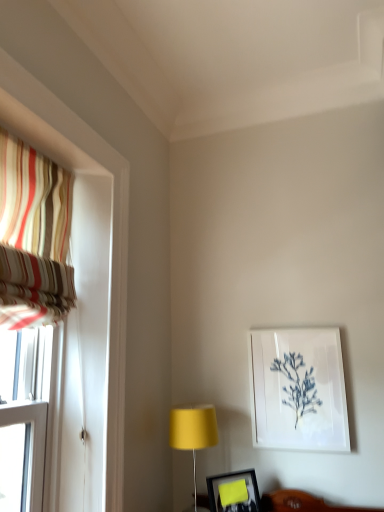
What do you see at coordinates (193, 430) in the screenshot? The height and width of the screenshot is (512, 384). I see `matte yellow lampshade at center` at bounding box center [193, 430].

Image resolution: width=384 pixels, height=512 pixels. What do you see at coordinates (234, 492) in the screenshot?
I see `matte black picture frame at lower center, the 1th picture frame from the left` at bounding box center [234, 492].

I want to click on matte yellow lampshade at center, so click(193, 430).

This screenshot has height=512, width=384. What are the coordinates of `table lamp in front of the matte black picture frame at lower center, which appears as the 2th picture frame when viewed from the right` in the screenshot? It's located at [x=193, y=430].

In the scene shown: From the image's perspective, does matte yellow lampshade at center appear higher than matte black picture frame at lower center, the 1th picture frame from the left?

Yes, from the image's perspective, matte yellow lampshade at center is above matte black picture frame at lower center, the 1th picture frame from the left.

Could you tell me if matte yellow lampshade at center is turned towards matte black picture frame at lower center, which appears as the 2th picture frame when viewed from the right?

No, matte yellow lampshade at center is not turned towards matte black picture frame at lower center, which appears as the 2th picture frame when viewed from the right.

Can you tell me how much matte black picture frame at lower center, the first picture frame positioned from the front, and striped fabric curtain at left differ in facing direction?

The facing directions of matte black picture frame at lower center, the first picture frame positioned from the front, and striped fabric curtain at left are 46.6 degrees apart.

Is matte black picture frame at lower center, which is the 2th picture frame in back-to-front order, positioned beyond the bounds of striped fabric curtain at left?

Yes, matte black picture frame at lower center, which is the 2th picture frame in back-to-front order, is not within striped fabric curtain at left.

Could you tell me if matte black picture frame at lower center, which is the 2th picture frame in top-to-bottom order, is turned towards striped fabric curtain at left?

No, matte black picture frame at lower center, which is the 2th picture frame in top-to-bottom order, does not turn towards striped fabric curtain at left.

Based on the photo, from the image's perspective, between matte black picture frame at lower center, the 1th picture frame from the bottom, and striped fabric curtain at left, who is located below?

matte black picture frame at lower center, the 1th picture frame from the bottom, from the image's perspective.

In the scene shown: From a real-world perspective, is matte yellow lampshade at center over striped fabric curtain at left?

No, from a real-world perspective, matte yellow lampshade at center is not over striped fabric curtain at left

Based on the photo, would you consider matte yellow lampshade at center to be distant from striped fabric curtain at left?

matte yellow lampshade at center is actually quite close to striped fabric curtain at left.

Which point is more forward, (x=211, y=436) or (x=44, y=275)?

The point (x=44, y=275) is more forward.

Considering the sizes of objects matte yellow lampshade at center and white paper at upper right, which is counted as the second picture frame, starting from the front, in the image provided, who is wider, matte yellow lampshade at center or white paper at upper right, which is counted as the second picture frame, starting from the front,?

matte yellow lampshade at center.

Are matte yellow lampshade at center and white paper at upper right, which ranks as the second picture frame in left-to-right order, making contact?

No, matte yellow lampshade at center is not making contact with white paper at upper right, which ranks as the second picture frame in left-to-right order.

From a real-world perspective, between matte yellow lampshade at center and white paper at upper right, which ranks as the second picture frame in left-to-right order, who is vertically lower?

matte yellow lampshade at center, from a real-world perspective.

Could you tell me if matte yellow lampshade at center is facing white paper at upper right, acting as the 1th picture frame starting from the right?

No, matte yellow lampshade at center is not oriented towards white paper at upper right, acting as the 1th picture frame starting from the right.

How many degrees apart are the facing directions of matte black picture frame at lower center, the 1th picture frame from the bottom, and white paper at upper right, the first picture frame from the back?

They differ by 44 degrees in their facing directions.

From their relative heights in the image, would you say matte black picture frame at lower center, the 1th picture frame from the left, is taller or shorter than white paper at upper right, which is counted as the second picture frame, starting from the front?

Clearly, matte black picture frame at lower center, the 1th picture frame from the left, is shorter compared to white paper at upper right, which is counted as the second picture frame, starting from the front.

Is matte black picture frame at lower center, which is the 2th picture frame in top-to-bottom order, bigger or smaller than white paper at upper right, placed as the 1th picture frame when sorted from top to bottom?

Considering their sizes, matte black picture frame at lower center, which is the 2th picture frame in top-to-bottom order, takes up less space than white paper at upper right, placed as the 1th picture frame when sorted from top to bottom.

Relative to white paper at upper right, placed as the 1th picture frame when sorted from top to bottom, is matte black picture frame at lower center, the 1th picture frame from the left, in front or behind?

Clearly, matte black picture frame at lower center, the 1th picture frame from the left, is in front of white paper at upper right, placed as the 1th picture frame when sorted from top to bottom.

Considering the relative sizes of white paper at upper right, acting as the 1th picture frame starting from the right, and matte yellow lampshade at center in the image provided, is white paper at upper right, acting as the 1th picture frame starting from the right, wider than matte yellow lampshade at center?

No, white paper at upper right, acting as the 1th picture frame starting from the right, is not wider than matte yellow lampshade at center.

From the image's perspective, which is above, white paper at upper right, which ranks as the second picture frame in left-to-right order, or matte yellow lampshade at center?

white paper at upper right, which ranks as the second picture frame in left-to-right order, is shown above in the image.

How different are the orientations of white paper at upper right, the first picture frame from the back, and matte yellow lampshade at center in degrees?

0.77 degrees.

Considering the positions of objects white paper at upper right, placed as the 1th picture frame when sorted from top to bottom, and matte yellow lampshade at center in the image provided, who is more to the left, white paper at upper right, placed as the 1th picture frame when sorted from top to bottom, or matte yellow lampshade at center?

matte yellow lampshade at center is more to the left.

Considering the relative sizes of white paper at upper right, the first picture frame from the back, and striped fabric curtain at left in the image provided, is white paper at upper right, the first picture frame from the back, thinner than striped fabric curtain at left?

Result: Yes, white paper at upper right, the first picture frame from the back, is thinner than striped fabric curtain at left.

Can you confirm if white paper at upper right, which ranks as the second picture frame in left-to-right order, is positioned to the left of striped fabric curtain at left?

In fact, white paper at upper right, which ranks as the second picture frame in left-to-right order, is to the right of striped fabric curtain at left.

From a real-world perspective, relative to striped fabric curtain at left, is white paper at upper right, which is counted as the second picture frame, starting from the front, vertically above or below?

Clearly, from a real-world perspective, white paper at upper right, which is counted as the second picture frame, starting from the front, is below striped fabric curtain at left.

Identify the location of the 1st picture frame behind the matte yellow lampshade at center. Image resolution: width=384 pixels, height=512 pixels. (234, 492).

Where is `curtain that is above the matte black picture frame at lower center, the 1th picture frame from the left (from a real-world perspective)`? This screenshot has height=512, width=384. curtain that is above the matte black picture frame at lower center, the 1th picture frame from the left (from a real-world perspective) is located at coordinates (33, 237).

From the picture: Considering their positions, is white paper at upper right, which ranks as the second picture frame in left-to-right order, positioned closer to striped fabric curtain at left than matte yellow lampshade at center?

matte yellow lampshade at center is closer to striped fabric curtain at left.

Based on their spatial positions, is matte black picture frame at lower center, the first picture frame positioned from the front, or striped fabric curtain at left further from white paper at upper right, the first picture frame from the back?

striped fabric curtain at left is positioned further to the anchor white paper at upper right, the first picture frame from the back.

From the picture: When comparing their distances from matte black picture frame at lower center, the first picture frame positioned from the front, does white paper at upper right, the second picture frame in the bottom-to-top sequence, or matte yellow lampshade at center seem closer?

matte yellow lampshade at center.

From the image, which object appears to be nearer to matte black picture frame at lower center, the 1th picture frame from the left, striped fabric curtain at left or matte yellow lampshade at center?

matte yellow lampshade at center.

Based on their spatial positions, is white paper at upper right, placed as the 1th picture frame when sorted from top to bottom, or matte black picture frame at lower center, the 1th picture frame from the bottom, closer to striped fabric curtain at left?

Among the two, white paper at upper right, placed as the 1th picture frame when sorted from top to bottom, is located nearer to striped fabric curtain at left.

Considering their positions, is matte black picture frame at lower center, which is the 2th picture frame in top-to-bottom order, positioned closer to striped fabric curtain at left than matte yellow lampshade at center?

The object closer to striped fabric curtain at left is matte yellow lampshade at center.

Based on their spatial positions, is striped fabric curtain at left or white paper at upper right, placed as the 1th picture frame when sorted from top to bottom, further from matte black picture frame at lower center, which appears as the 2th picture frame when viewed from the right?

striped fabric curtain at left is positioned further to the anchor matte black picture frame at lower center, which appears as the 2th picture frame when viewed from the right.

Considering their positions, is striped fabric curtain at left positioned further to white paper at upper right, which is counted as the second picture frame, starting from the front, than matte black picture frame at lower center, the 1th picture frame from the left?

Among the two, striped fabric curtain at left is located further to white paper at upper right, which is counted as the second picture frame, starting from the front.

This screenshot has height=512, width=384. I want to click on picture frame between striped fabric curtain at left and white paper at upper right, which ranks as the second picture frame in left-to-right order, so [x=234, y=492].

Locate an element on the screen. The width and height of the screenshot is (384, 512). table lamp located between striped fabric curtain at left and white paper at upper right, the first picture frame from the back, in the left-right direction is located at coordinates (193, 430).

You are a GUI agent. You are given a task and a screenshot of the screen. Output one action in this format:
    pyautogui.click(x=<x>, y=<y>)
    Task: Click on the table lamp between striped fabric curtain at left and matte black picture frame at lower center, the first picture frame positioned from the front, in the vertical direction
    The image size is (384, 512).
    Given the screenshot: What is the action you would take?
    pyautogui.click(x=193, y=430)

This screenshot has width=384, height=512. I want to click on picture frame between matte yellow lampshade at center and white paper at upper right, which ranks as the second picture frame in left-to-right order, from left to right, so click(x=234, y=492).